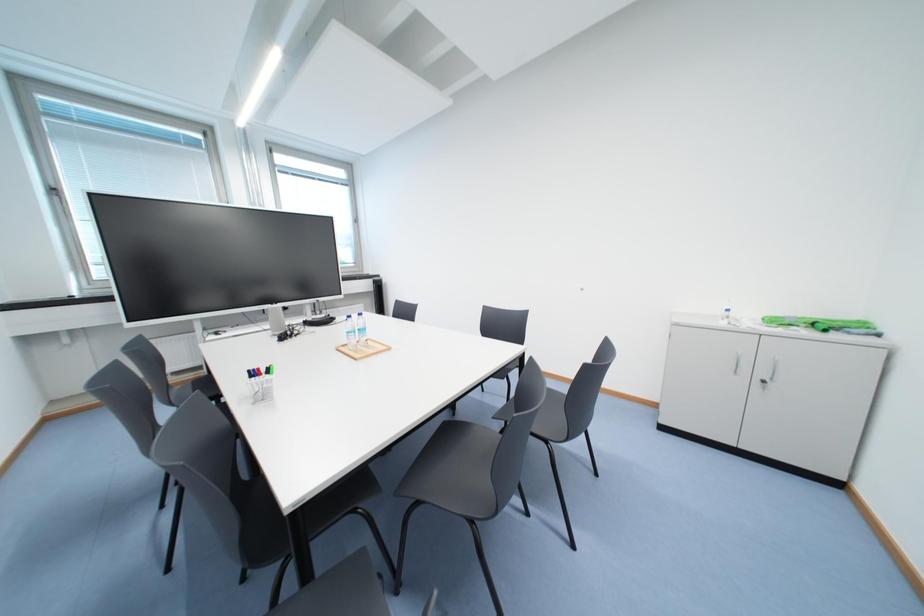
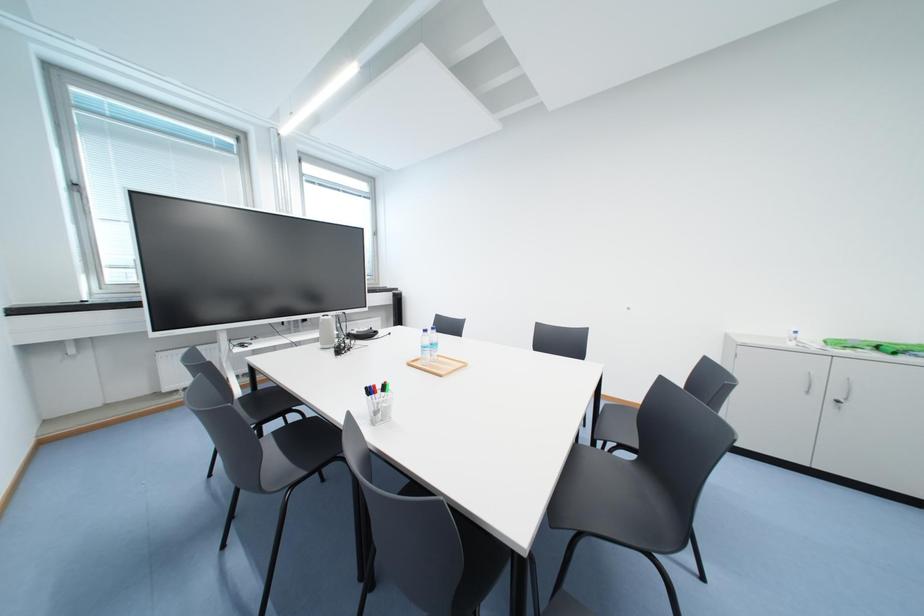
Question: Based on the continuous images, in which direction is the camera rotating? Reply with the corresponding letter.

Choices:
 (A) Left
 (B) Right
 (C) Up
 (D) Down

Answer: (C)